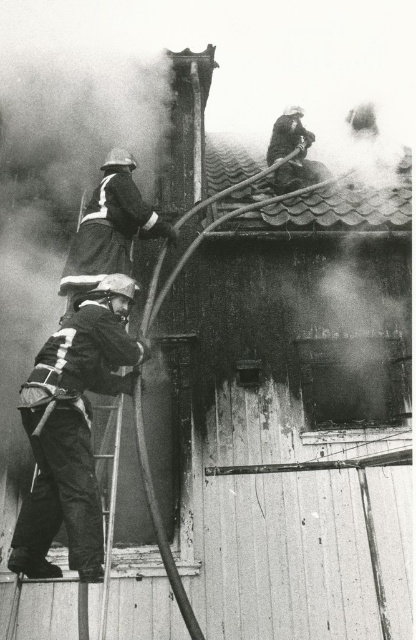
Question: Is the position of black matte uniform at lower left more distant than that of dark gray uniform at center?

Choices:
 (A) no
 (B) yes

Answer: (A)

Question: Can you confirm if black matte uniform at lower left is thinner than metallic silver ladder at lower center?

Choices:
 (A) no
 (B) yes

Answer: (A)

Question: Which object is the farthest from the dark gray uniform at center?

Choices:
 (A) shiny tiled roof at upper center
 (B) black matte uniform at lower left
 (C) metallic silver ladder at lower center

Answer: (A)

Question: Can you confirm if shiny tiled roof at upper center is wider than dark gray uniform at center?

Choices:
 (A) no
 (B) yes

Answer: (B)

Question: Which of these objects is positioned closest to the black matte uniform at lower left?

Choices:
 (A) metallic silver ladder at lower center
 (B) shiny tiled roof at upper center
 (C) dark gray uniform at center

Answer: (A)

Question: Which of the following is the farthest from the observer?

Choices:
 (A) (86, 595)
 (B) (22, 388)
 (C) (237, 189)

Answer: (C)